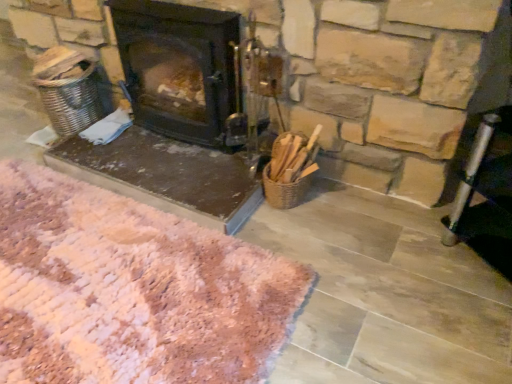
At what (x,y) coordinates should I click in order to perform the action: click on pink shaggy rug at lower left. Please return your answer as a coordinate pair (x, y). Looking at the image, I should click on [x=131, y=290].

This screenshot has height=384, width=512. What do you see at coordinates (131, 290) in the screenshot? I see `pink shaggy rug at lower left` at bounding box center [131, 290].

Measure the distance between pink shaggy rug at lower left and camera.

The distance of pink shaggy rug at lower left from camera is 3.74 feet.

The height and width of the screenshot is (384, 512). What do you see at coordinates (182, 70) in the screenshot?
I see `black matte wood burning stove at center` at bounding box center [182, 70].

I want to click on black matte wood burning stove at center, so click(x=182, y=70).

Image resolution: width=512 pixels, height=384 pixels. What are the coordinates of `pink shaggy rug at lower left` in the screenshot? It's located at (131, 290).

Which is more to the right, pink shaggy rug at lower left or black matte wood burning stove at center?

black matte wood burning stove at center is more to the right.

Is the depth of pink shaggy rug at lower left less than that of black matte wood burning stove at center?

Yes.

Is point (24, 236) behind point (193, 112)?

No, (24, 236) is in front of (193, 112).

From the image's perspective, between pink shaggy rug at lower left and black matte wood burning stove at center, which one is located above?

black matte wood burning stove at center.

Looking at this image, from a real-world perspective, between pink shaggy rug at lower left and black matte wood burning stove at center, who is vertically lower?

From a 3D spatial view, pink shaggy rug at lower left is below.

Between pink shaggy rug at lower left and black matte wood burning stove at center, which one has smaller width?

black matte wood burning stove at center is thinner.

Considering the sizes of objects pink shaggy rug at lower left and black matte wood burning stove at center in the image provided, who is taller, pink shaggy rug at lower left or black matte wood burning stove at center?

With more height is black matte wood burning stove at center.

Between pink shaggy rug at lower left and black matte wood burning stove at center, which one has smaller size?

With smaller size is black matte wood burning stove at center.

Is pink shaggy rug at lower left inside or outside of black matte wood burning stove at center?

pink shaggy rug at lower left is located beyond the bounds of black matte wood burning stove at center.

Is pink shaggy rug at lower left beside black matte wood burning stove at center?

pink shaggy rug at lower left and black matte wood burning stove at center are clearly separated.

Is pink shaggy rug at lower left looking in the opposite direction of black matte wood burning stove at center?

pink shaggy rug at lower left does not have its back to black matte wood burning stove at center.

How distant is pink shaggy rug at lower left from black matte wood burning stove at center?

pink shaggy rug at lower left and black matte wood burning stove at center are 67.35 centimeters apart.

Where is `wood burning stove above the pink shaggy rug at lower left (from a real-world perspective)`? The image size is (512, 384). wood burning stove above the pink shaggy rug at lower left (from a real-world perspective) is located at coordinates (182, 70).

Considering the positions of objects black matte wood burning stove at center and pink shaggy rug at lower left in the image provided, who is more to the left, black matte wood burning stove at center or pink shaggy rug at lower left?

pink shaggy rug at lower left.

Does black matte wood burning stove at center lie in front of pink shaggy rug at lower left?

No.

Does point (189, 111) appear closer or farther from the camera than point (76, 209)?

Clearly, point (189, 111) is more distant from the camera than point (76, 209).

From the image's perspective, which is above, black matte wood burning stove at center or pink shaggy rug at lower left?

From the image's view, black matte wood burning stove at center is above.

From a real-world perspective, is black matte wood burning stove at center located higher than pink shaggy rug at lower left?

Indeed, from a real-world perspective, black matte wood burning stove at center stands above pink shaggy rug at lower left.

Can you confirm if black matte wood burning stove at center is wider than pink shaggy rug at lower left?

Incorrect, the width of black matte wood burning stove at center does not surpass that of pink shaggy rug at lower left.

Can you confirm if black matte wood burning stove at center is shorter than pink shaggy rug at lower left?

No, black matte wood burning stove at center is not shorter than pink shaggy rug at lower left.

Is black matte wood burning stove at center bigger than pink shaggy rug at lower left?

Actually, black matte wood burning stove at center might be smaller than pink shaggy rug at lower left.

Could pink shaggy rug at lower left be considered to be inside black matte wood burning stove at center?

Actually, pink shaggy rug at lower left is outside black matte wood burning stove at center.

Would you say black matte wood burning stove at center is a long distance from pink shaggy rug at lower left?

Actually, black matte wood burning stove at center and pink shaggy rug at lower left are a little close together.

Based on the photo, is black matte wood burning stove at center facing towards pink shaggy rug at lower left?

Yes, black matte wood burning stove at center is aimed at pink shaggy rug at lower left.

Can you tell me how much black matte wood burning stove at center and pink shaggy rug at lower left differ in facing direction?

2.32 degrees.

How distant is black matte wood burning stove at center from pink shaggy rug at lower left?

black matte wood burning stove at center is 26.52 inches from pink shaggy rug at lower left.

There is a pink shaggy rug at lower left. At what (x,y) coordinates should I click in order to perform the action: click on wood burning stove above it (from a real-world perspective). Please return your answer as a coordinate pair (x, y). The height and width of the screenshot is (384, 512). Looking at the image, I should click on (182, 70).

This screenshot has height=384, width=512. I want to click on wood burning stove above the pink shaggy rug at lower left (from a real-world perspective), so [x=182, y=70].

Where is `wood burning stove that appears above the pink shaggy rug at lower left (from the image's perspective)`? The image size is (512, 384). wood burning stove that appears above the pink shaggy rug at lower left (from the image's perspective) is located at coordinates click(x=182, y=70).